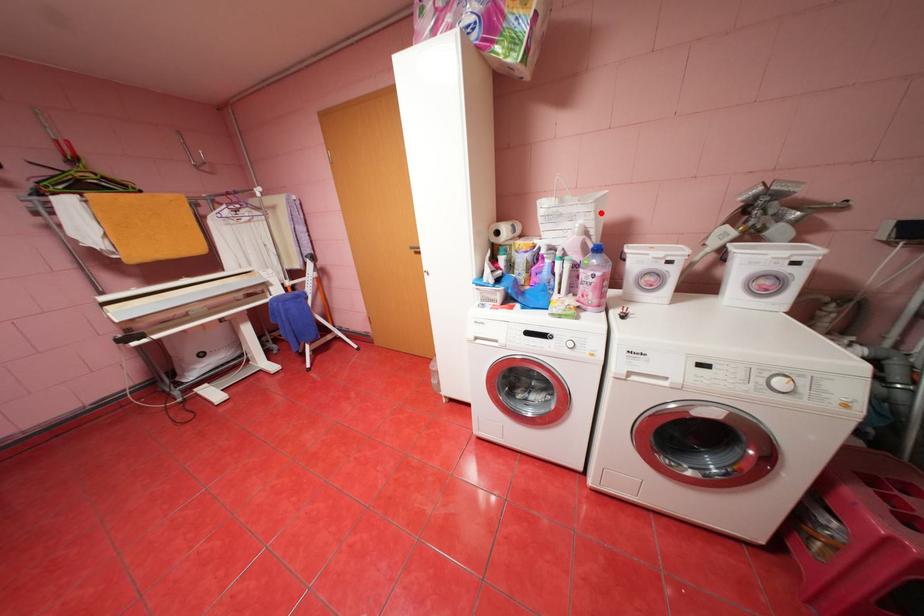
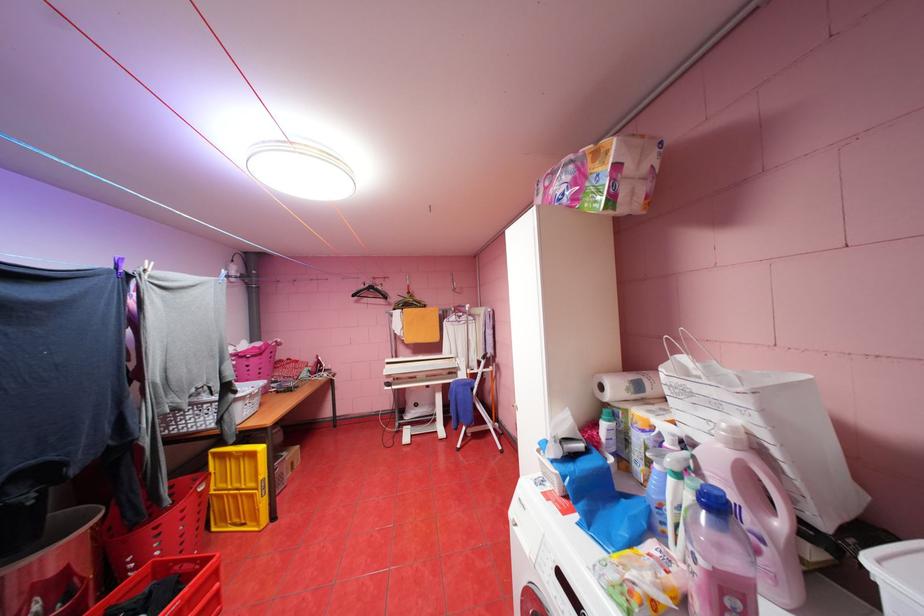
Locate, in the second image, the point that corresponds to the highlighted location in the first image.

(763, 413)